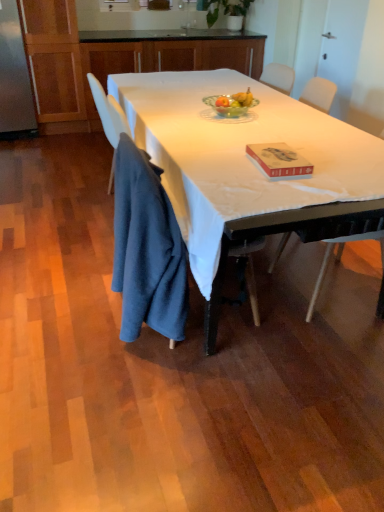
Question: Considering the relative positions of wooden cabinet at upper center, which appears as the 2th cabinetry when viewed from the top, and white matte table at center in the image provided, is wooden cabinet at upper center, which appears as the 2th cabinetry when viewed from the top, to the right of white matte table at center from the viewer's perspective?

Choices:
 (A) yes
 (B) no

Answer: (B)

Question: Does wooden cabinet at upper center, which appears as the 2th cabinetry when viewed from the top, have a greater width compared to white matte table at center?

Choices:
 (A) no
 (B) yes

Answer: (A)

Question: From a real-world perspective, is wooden cabinet at upper center, positioned as the 1th cabinetry in bottom-to-top order, beneath white matte table at center?

Choices:
 (A) no
 (B) yes

Answer: (A)

Question: Can you confirm if wooden cabinet at upper center, positioned as the 1th cabinetry in bottom-to-top order, is taller than white matte table at center?

Choices:
 (A) no
 (B) yes

Answer: (B)

Question: Can you confirm if wooden cabinet at upper center, positioned as the 1th cabinetry in bottom-to-top order, is bigger than white matte table at center?

Choices:
 (A) no
 (B) yes

Answer: (B)

Question: Choose the correct answer: Is wooden cabinet at upper center, which appears as the 2th cabinetry when viewed from the top, inside wooden cabinets at upper center, acting as the first cabinetry starting from the top, or outside it?

Choices:
 (A) outside
 (B) inside

Answer: (A)

Question: In terms of size, does wooden cabinet at upper center, positioned as the 1th cabinetry in bottom-to-top order, appear bigger or smaller than wooden cabinets at upper center, placed as the 2th cabinetry when sorted from bottom to top?

Choices:
 (A) big
 (B) small

Answer: (A)

Question: From a real-world perspective, is wooden cabinet at upper center, positioned as the 1th cabinetry in bottom-to-top order, physically located above or below wooden cabinets at upper center, placed as the 2th cabinetry when sorted from bottom to top?

Choices:
 (A) above
 (B) below

Answer: (B)

Question: Is wooden cabinet at upper center, positioned as the 1th cabinetry in bottom-to-top order, taller or shorter than wooden cabinets at upper center, acting as the first cabinetry starting from the top?

Choices:
 (A) short
 (B) tall

Answer: (B)

Question: Looking at their shapes, would you say red matte book at center is wider or thinner than dark blue fabric at lower left?

Choices:
 (A) thin
 (B) wide

Answer: (A)

Question: From the image's perspective, relative to dark blue fabric at lower left, is red matte book at center above or below?

Choices:
 (A) above
 (B) below

Answer: (A)

Question: Relative to dark blue fabric at lower left, is red matte book at center in front or behind?

Choices:
 (A) behind
 (B) front

Answer: (A)

Question: Looking at the image, does red matte book at center seem bigger or smaller compared to dark blue fabric at lower left?

Choices:
 (A) big
 (B) small

Answer: (B)

Question: Considering the positions of green glass bowl at center and red matte book at center in the image, is green glass bowl at center bigger or smaller than red matte book at center?

Choices:
 (A) small
 (B) big

Answer: (B)

Question: Is point (221, 103) closer or farther from the camera than point (274, 177)?

Choices:
 (A) closer
 (B) farther

Answer: (B)